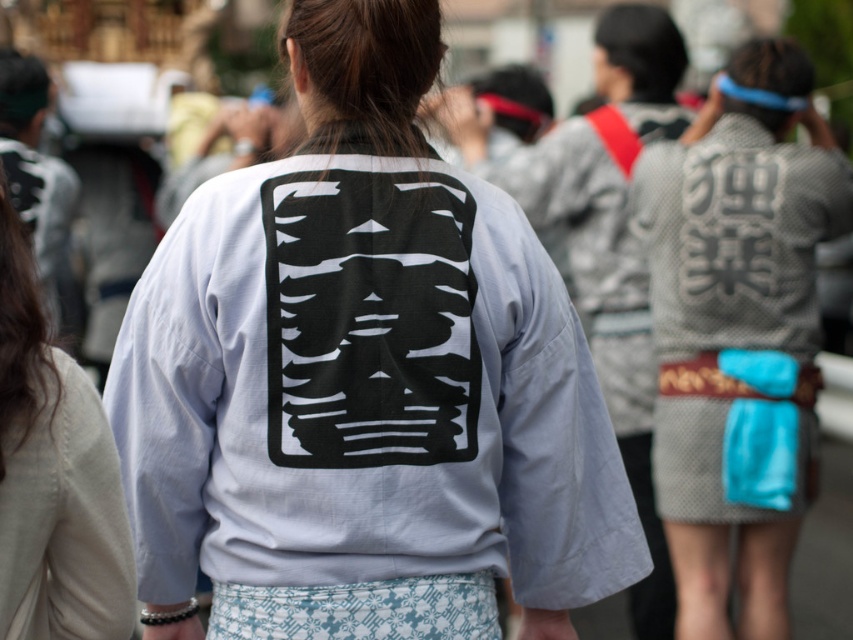
Can you confirm if white cotton kimono at center is shorter than light gray cotton kimono at center?

No, white cotton kimono at center is not shorter than light gray cotton kimono at center.

The height and width of the screenshot is (640, 853). What do you see at coordinates (363, 380) in the screenshot? I see `white cotton kimono at center` at bounding box center [363, 380].

Between point (248, 310) and point (18, 496), which one is positioned in front?

Point (18, 496)

Locate an element on the screen. white cotton kimono at center is located at coordinates (363, 380).

Which is behind, point (341, 317) or point (656, 145)?

Positioned behind is point (656, 145).

Between white cotton kimono at center and white textured kimono at center, which one is positioned higher?

Positioned higher is white textured kimono at center.

Between point (358, 45) and point (772, 321), which one is positioned behind?

Positioned behind is point (772, 321).

Identify the location of white cotton kimono at center. The height and width of the screenshot is (640, 853). (363, 380).

This screenshot has width=853, height=640. What do you see at coordinates (735, 237) in the screenshot?
I see `white textured kimono at center` at bounding box center [735, 237].

Can you confirm if white textured kimono at center is taller than light gray cotton kimono at center?

No, white textured kimono at center is not taller than light gray cotton kimono at center.

Who is more forward, [724,401] or [102,579]?

Point [102,579] is in front.

The width and height of the screenshot is (853, 640). What are the coordinates of `white textured kimono at center` in the screenshot? It's located at (735, 237).